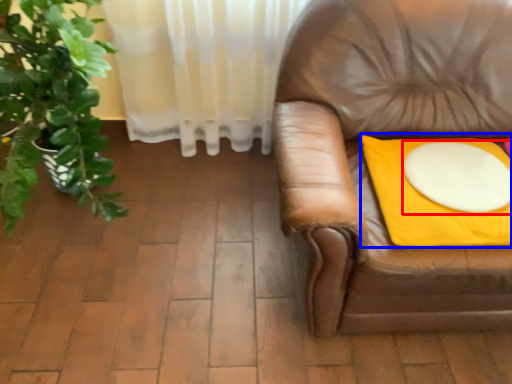
Question: Which object appears closest to the camera in this image, round table (highlighted by a red box) or blanket (highlighted by a blue box)?

Choices:
 (A) round table
 (B) blanket

Answer: (B)